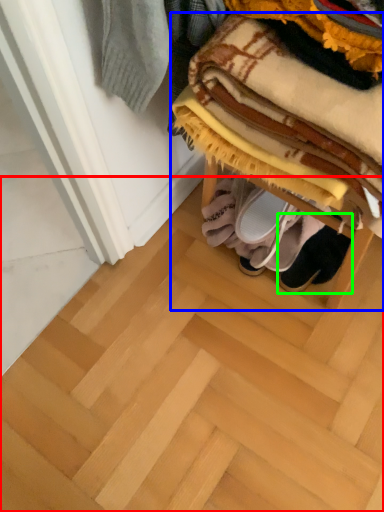
Question: Considering the real-world distances, which object is farthest from stair (highlighted by a red box)? furniture (highlighted by a blue box) or footwear (highlighted by a green box)?

Choices:
 (A) furniture
 (B) footwear

Answer: (A)